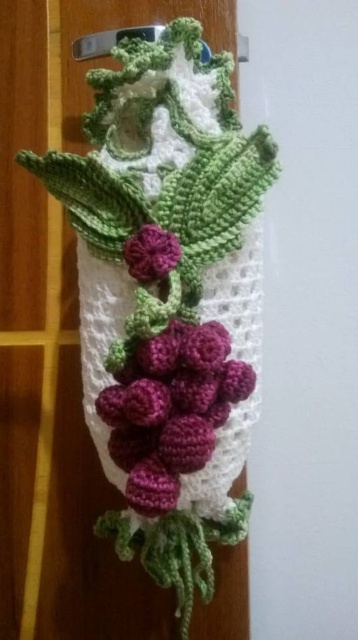
Question: Can you confirm if crochet scarf at center is thinner than matte purple yarn grapes at center?

Choices:
 (A) no
 (B) yes

Answer: (A)

Question: Does matte purple yarn grapes at center appear under matte purple flower at center?

Choices:
 (A) no
 (B) yes

Answer: (B)

Question: Which of the following is the farthest from the observer?

Choices:
 (A) (114, 422)
 (B) (218, 198)

Answer: (B)

Question: Among these objects, which one is farthest from the camera?

Choices:
 (A) matte purple yarn grapes at center
 (B) matte purple flower at center
 (C) crochet scarf at center

Answer: (B)

Question: Which of these objects is positioned farthest from the matte purple flower at center?

Choices:
 (A) crochet scarf at center
 (B) matte purple yarn grapes at center

Answer: (A)

Question: Does crochet scarf at center come behind matte purple flower at center?

Choices:
 (A) no
 (B) yes

Answer: (A)